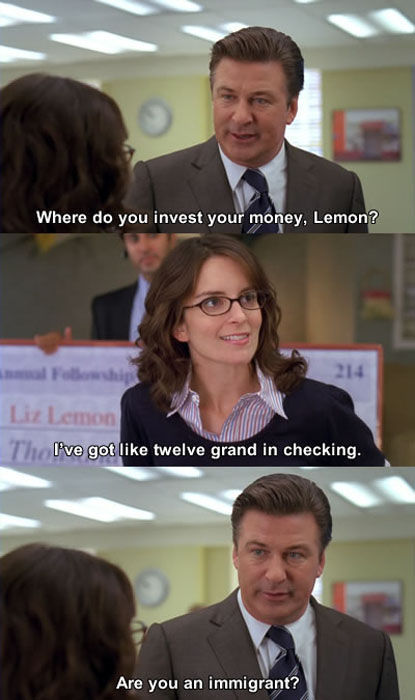
You are a GUI agent. You are given a task and a screenshot of the screen. Output one action in this format:
    pyautogui.click(x=<x>, y=<y>)
    Task: Click on the picture
    This screenshot has height=700, width=415.
    Given the screenshot: What is the action you would take?
    pyautogui.click(x=383, y=598), pyautogui.click(x=376, y=132)